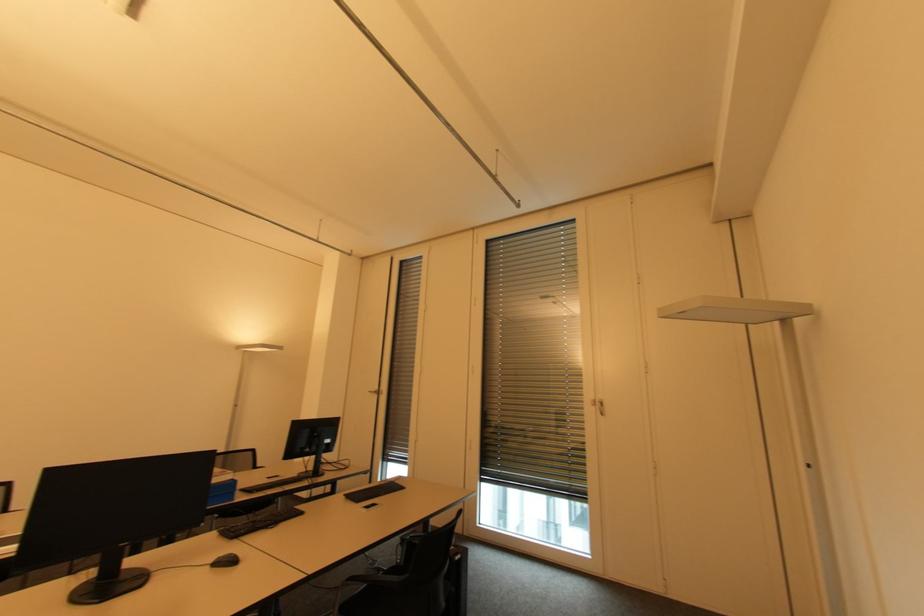
At what (x,y) coordinates should I click in order to perform the action: click on silver door handle. Please return your answer as a coordinate pair (x, y). The height and width of the screenshot is (616, 924). Looking at the image, I should click on (598, 406).